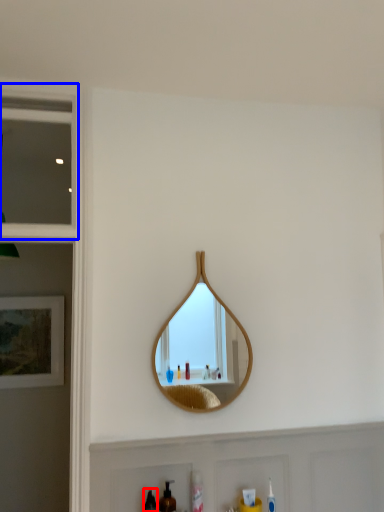
Question: Which of the following is the farthest to the observer, mouthwash (highlighted by a red box) or window (highlighted by a blue box)?

Choices:
 (A) mouthwash
 (B) window

Answer: (B)